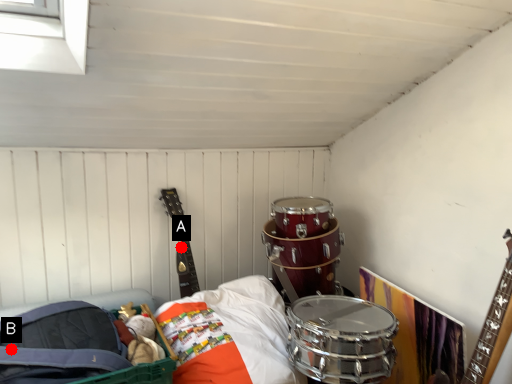
Question: Two points are circled on the image, labeled by A and B beside each circle. Which of the following is the farthest from the observer?

Choices:
 (A) A is further
 (B) B is further

Answer: (A)